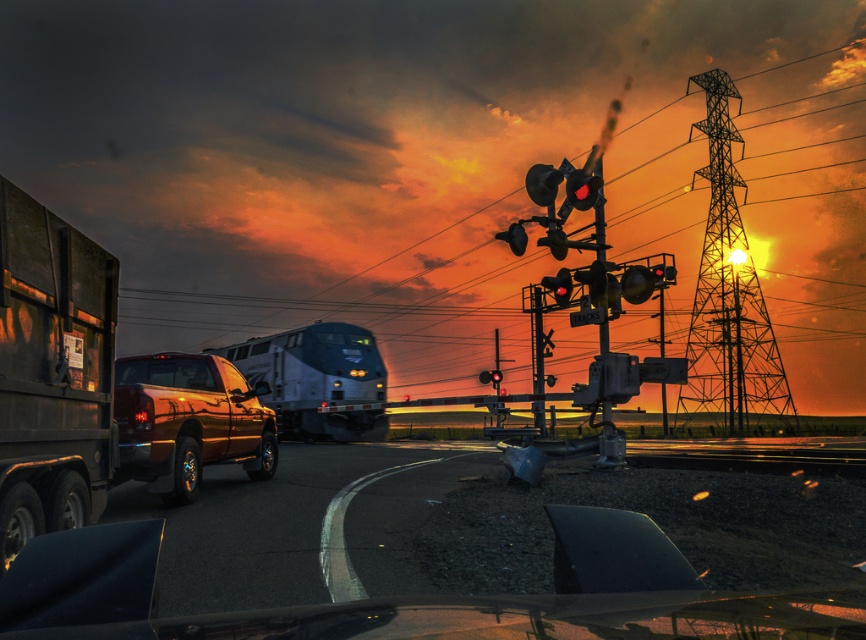
You are driving a car and see both the metallic red traffic light at upper right and the red glass traffic light at center. Which traffic light is positioned further to the left?

The metallic red traffic light at upper right is positioned to the left of the red glass traffic light at center, so it is further to the left.

You are driving a car and see the dark matte trailer truck at left and the red glass traffic light at center. Which object is closer to you?

The dark matte trailer truck at left is closer to you because it is in front of the red glass traffic light at center.